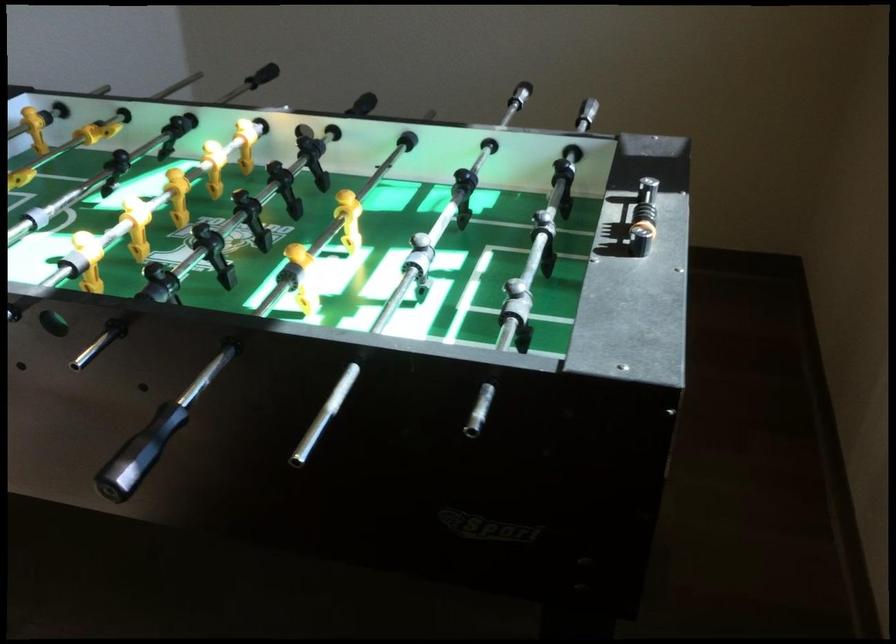
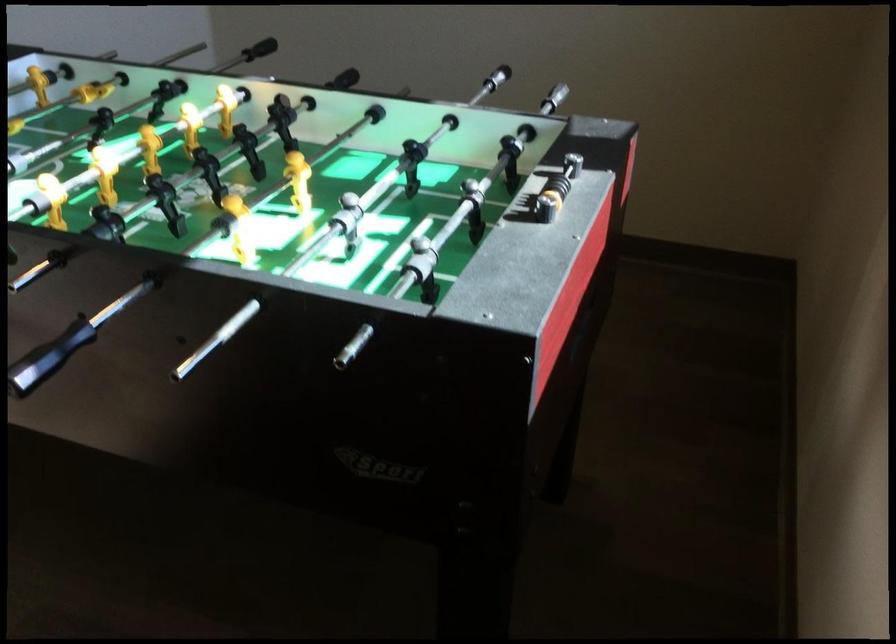
Locate, in the second image, the point that corresponds to (x=645, y=214) in the first image.

(556, 185)